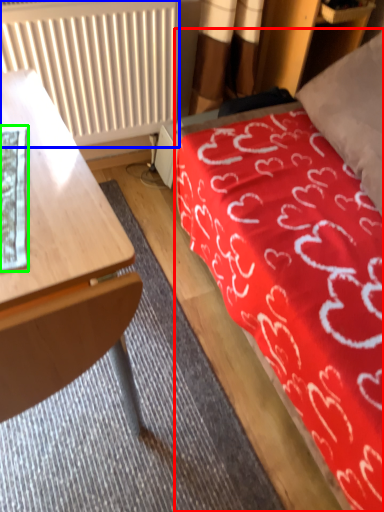
Question: Considering the real-world distances, which object is closest to bed (highlighted by a red box)? radiator (highlighted by a blue box) or sheet (highlighted by a green box).

Choices:
 (A) radiator
 (B) sheet

Answer: (A)